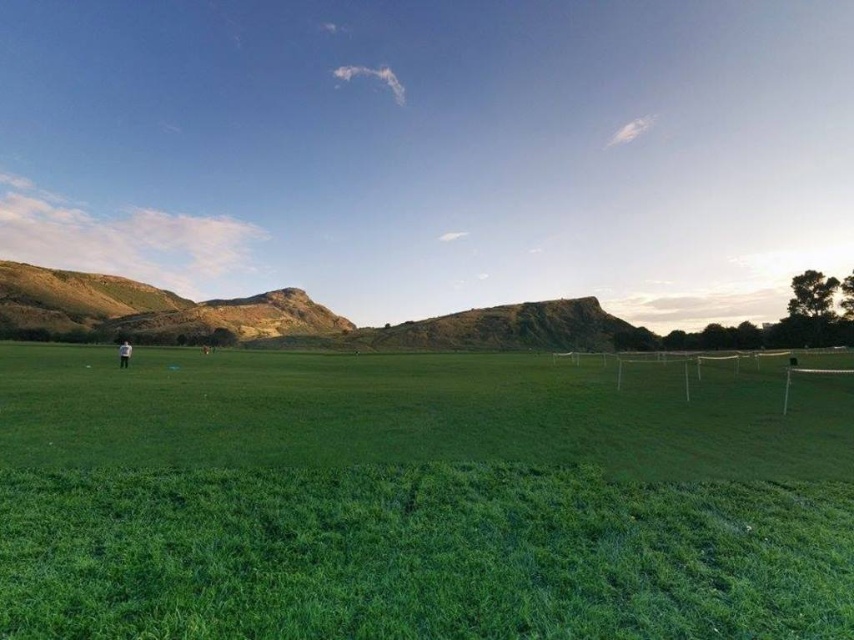
Is point (699, 483) in front of point (121, 365)?

Yes, it is.

Is green grass at center wider than white fabric person at left?

Correct, the width of green grass at center exceeds that of white fabric person at left.

The image size is (854, 640). Find the location of `green grass at center`. green grass at center is located at coordinates (414, 500).